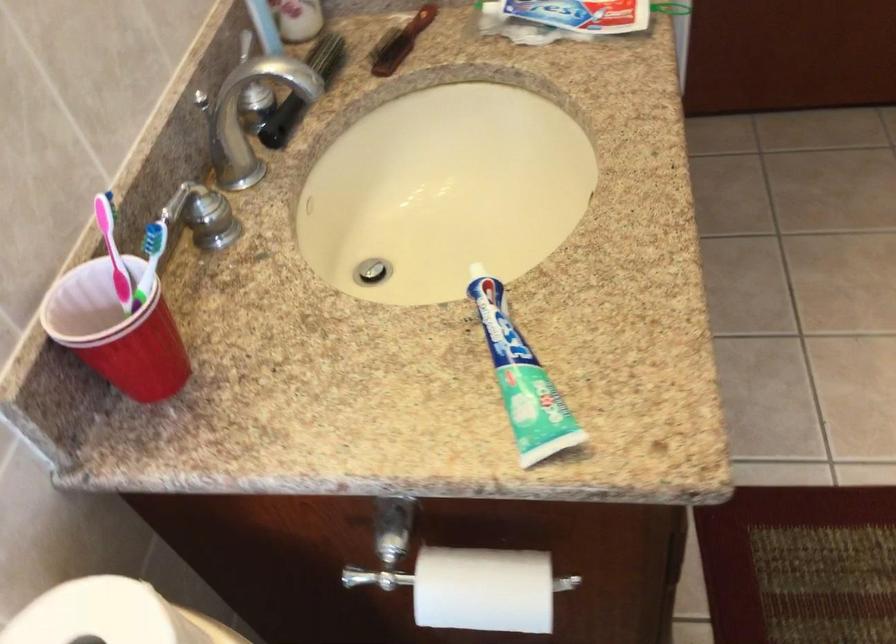
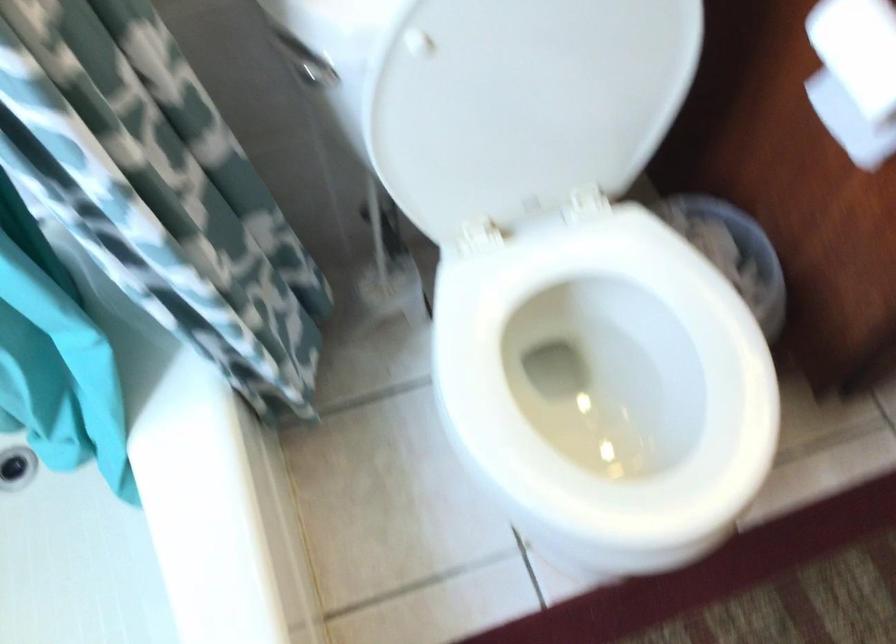
The first image is from the beginning of the video and the second image is from the end. How did the camera likely rotate when shooting the video?

The camera rotated toward left-down.